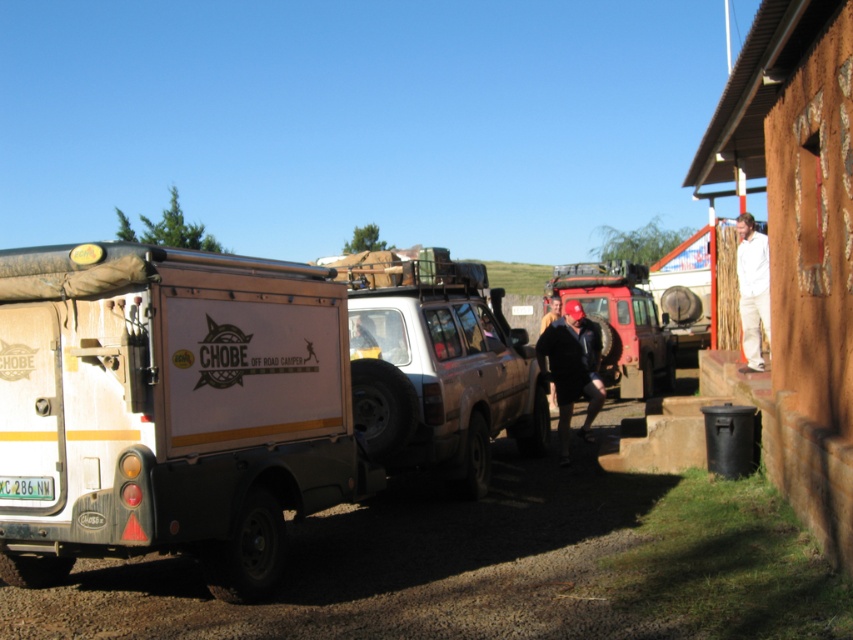
You are a photographer planning to take a picture of the matte red jeep at center and the brown leather jacket at center. Which object should you focus on first if you want to capture both in the same frame without moving the camera?

The matte red jeep at center is smaller than the brown leather jacket at center, so you should focus on the matte red jeep at center first to ensure it is in focus before the larger jacket.

Based on the photo, you are standing in front of the matte red jeep at center and the dark blue jeans at center. Which object is closer to you?

The matte red jeep at center is closer to you than the dark blue jeans at center.